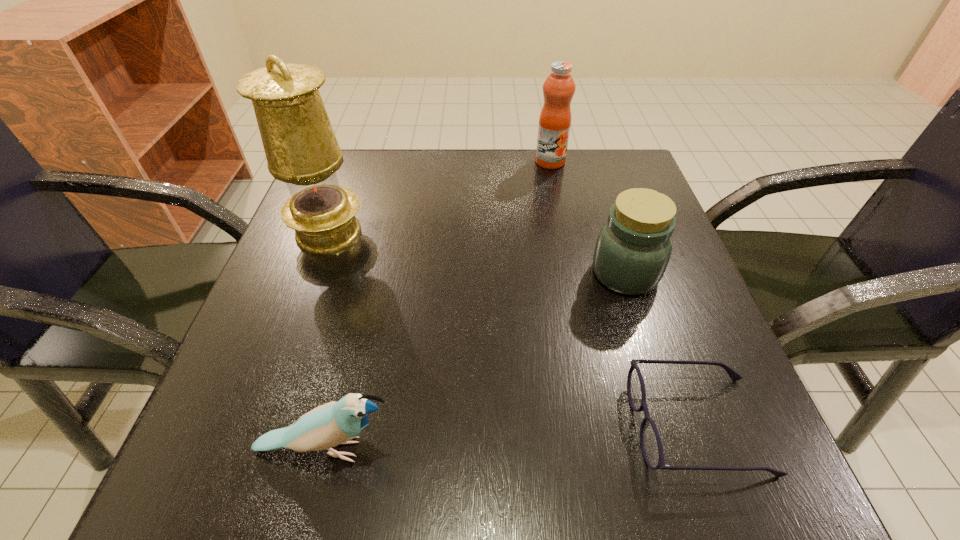
The image size is (960, 540). What are the coordinates of `free location that satisfies the following two spatial constraints: 1. on the front side of the oil lamp; 2. on the right side of the jar` in the screenshot? It's located at [314, 273].

Where is `vacant point that satisfies the following two spatial constraints: 1. on the front label of the jar; 2. on the left side of the fruit juice`? vacant point that satisfies the following two spatial constraints: 1. on the front label of the jar; 2. on the left side of the fruit juice is located at coordinates (573, 273).

Find the location of a particular element. This screenshot has width=960, height=540. vacant area in the image that satisfies the following two spatial constraints: 1. on the front label of the jar; 2. on the left side of the farthest object is located at coordinates (573, 273).